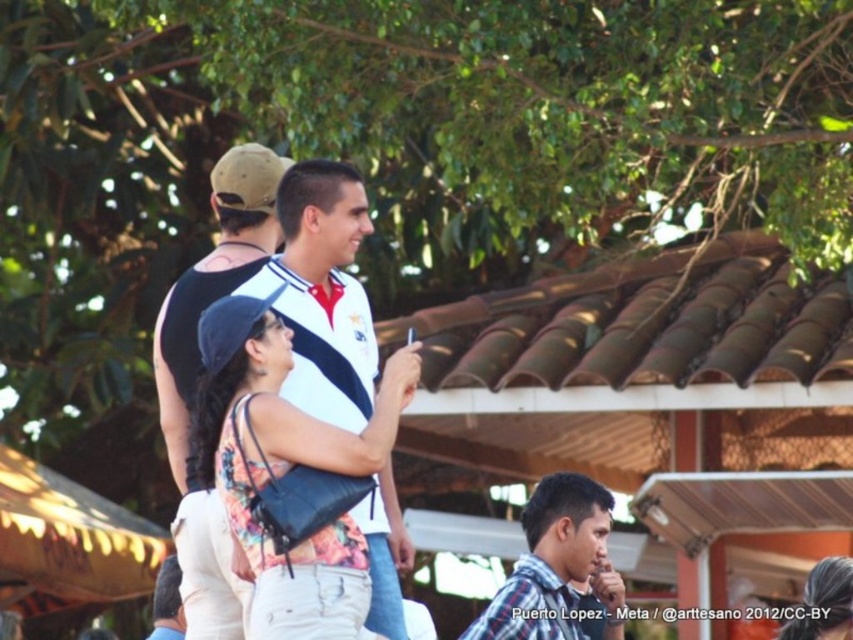
What is the position of the point with coordinates (213,282) in the image?

The point with coordinates (213,282) is located on the black matte tank top at center.

You are organizing a clothing display and need to arrange the floral fabric top at center and the plaid cotton shirt at center side by side. Based on their sizes, which one should be placed on the left to ensure they fit within a 1.2 meter wide display area?

The floral fabric top at center has a smaller width than the plaid cotton shirt at center. To fit both within the 1.2 meter display area, place the narrower floral fabric top at center on the left and the wider plaid cotton shirt at center on the right.